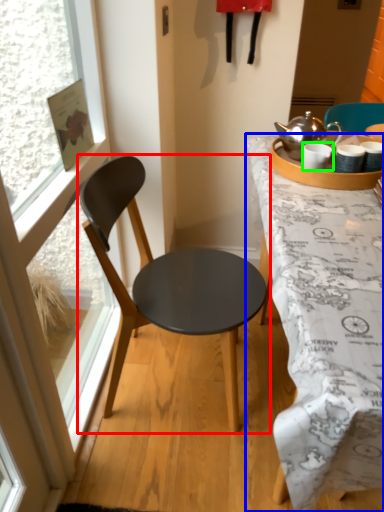
Question: Based on their relative distances, which object is nearer to chair (highlighted by a red box)? Choose from desk (highlighted by a blue box) and coffee cup (highlighted by a green box).

Choices:
 (A) desk
 (B) coffee cup

Answer: (A)